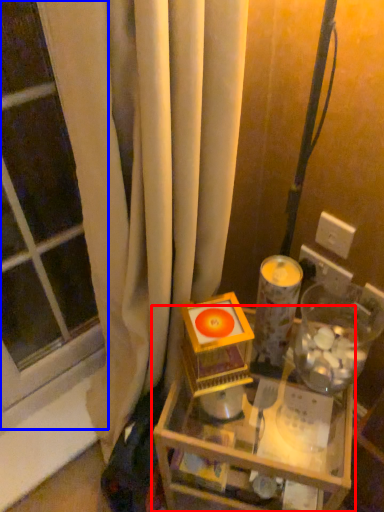
Question: Among these objects, which one is farthest to the camera, table (highlighted by a red box) or window (highlighted by a blue box)?

Choices:
 (A) table
 (B) window

Answer: (A)